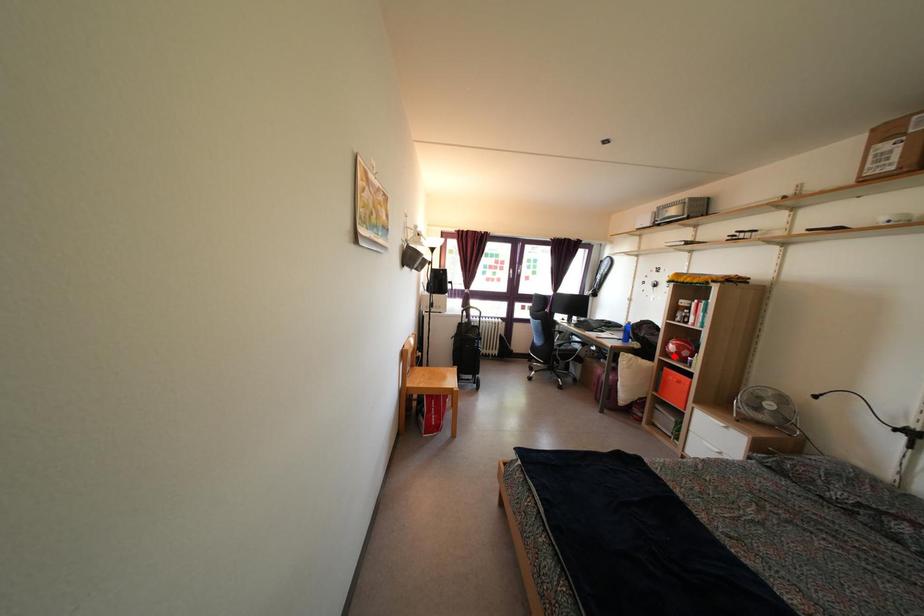
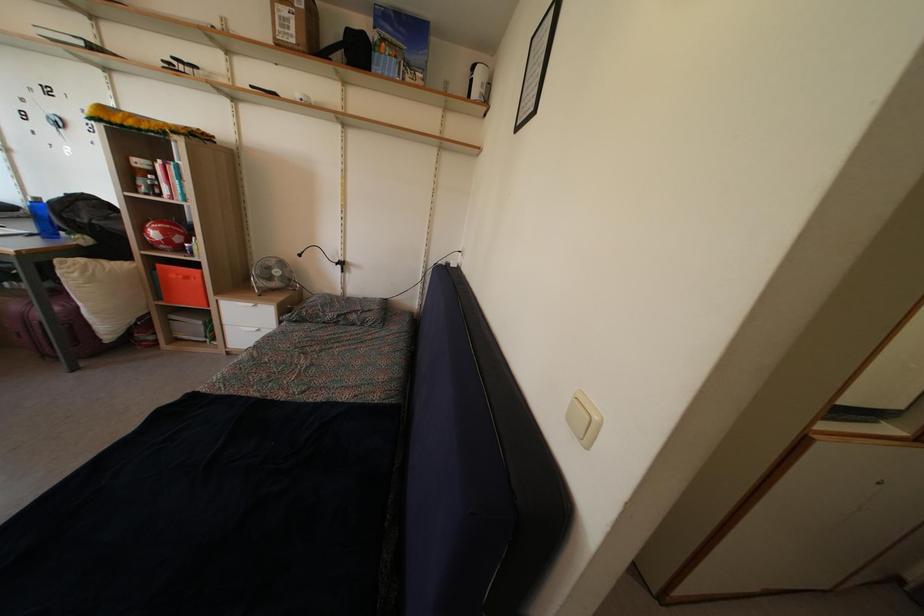
Locate, in the second image, the point that corresponds to the highlighted location in the first image.

(157, 243)